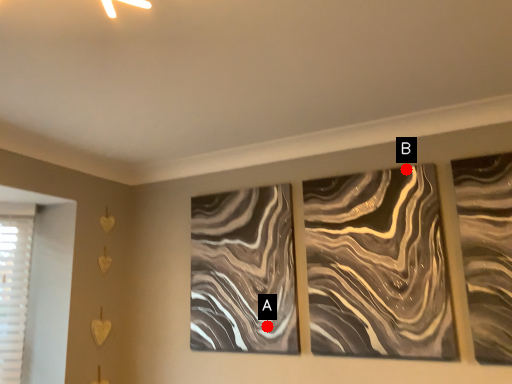
Question: Two points are circled on the image, labeled by A and B beside each circle. Which point appears closest to the camera in this image?

Choices:
 (A) A is closer
 (B) B is closer

Answer: (B)